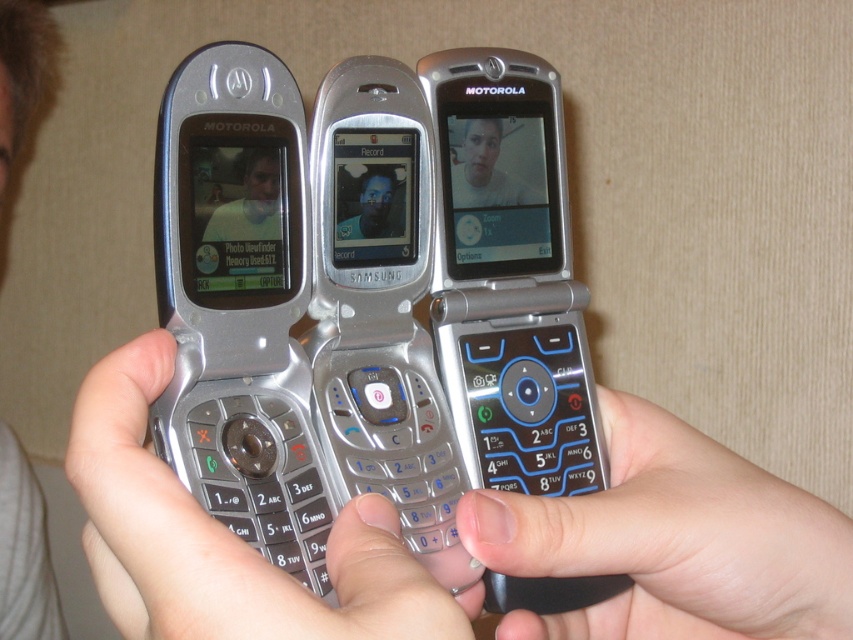
Does point (409, 484) come closer to viewer compared to point (213, 240)?

No, (409, 484) is further to viewer.

Image resolution: width=853 pixels, height=640 pixels. What do you see at coordinates (381, 314) in the screenshot? I see `satin silver phone at center` at bounding box center [381, 314].

Between point (408, 136) and point (267, 148), which one is positioned in front?

Point (267, 148) is more forward.

Find the location of `satin silver phone at center`. satin silver phone at center is located at coordinates (381, 314).

Does metallic silver keypad at center appear under white matte face at center?

Indeed, metallic silver keypad at center is positioned under white matte face at center.

Image resolution: width=853 pixels, height=640 pixels. What are the coordinates of `metallic silver keypad at center` in the screenshot? It's located at (224, 538).

Can you confirm if satin silver phone at center is smaller than metallic silver keypad at center?

Correct, satin silver phone at center occupies less space than metallic silver keypad at center.

In order to click on satin silver phone at center in this screenshot , I will do `click(381, 314)`.